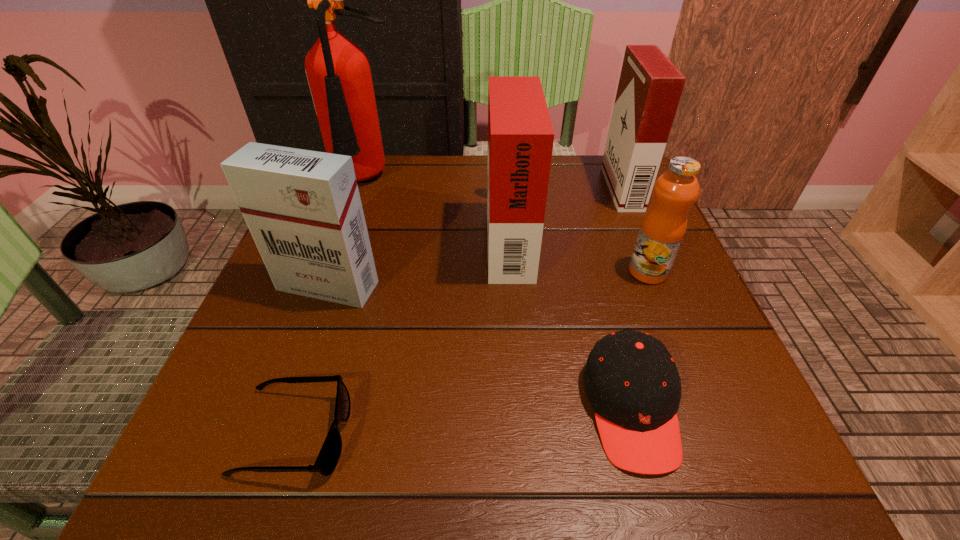
The height and width of the screenshot is (540, 960). Find the location of `sunglasses at the near edge`. sunglasses at the near edge is located at coordinates (326, 462).

Find the location of a particular element. fire extinguisher situated at the left edge is located at coordinates (338, 71).

The height and width of the screenshot is (540, 960). I want to click on cigarette case positioned at the left edge, so click(303, 209).

Identify the location of sunglasses that is at the left edge. (326, 462).

Where is `cigarette_case located in the right edge section of the desktop`? The image size is (960, 540). cigarette_case located in the right edge section of the desktop is located at coordinates (650, 86).

You are a GUI agent. You are given a task and a screenshot of the screen. Output one action in this format:
    pyautogui.click(x=<x>, y=<y>)
    Task: Click on the fruit juice that is positioned at the right edge
    The height and width of the screenshot is (540, 960).
    Given the screenshot: What is the action you would take?
    pyautogui.click(x=664, y=225)

The image size is (960, 540). What are the coordinates of `cap positioned at the right edge` in the screenshot? It's located at (631, 380).

Identify the location of object at the far left corner. (338, 71).

Identify the location of object present at the near left corner. The image size is (960, 540). tap(326, 462).

At what (x,y) coordinates should I click in order to perform the action: click on object at the far right corner. Please return your answer as a coordinate pair (x, y). Looking at the image, I should click on (650, 86).